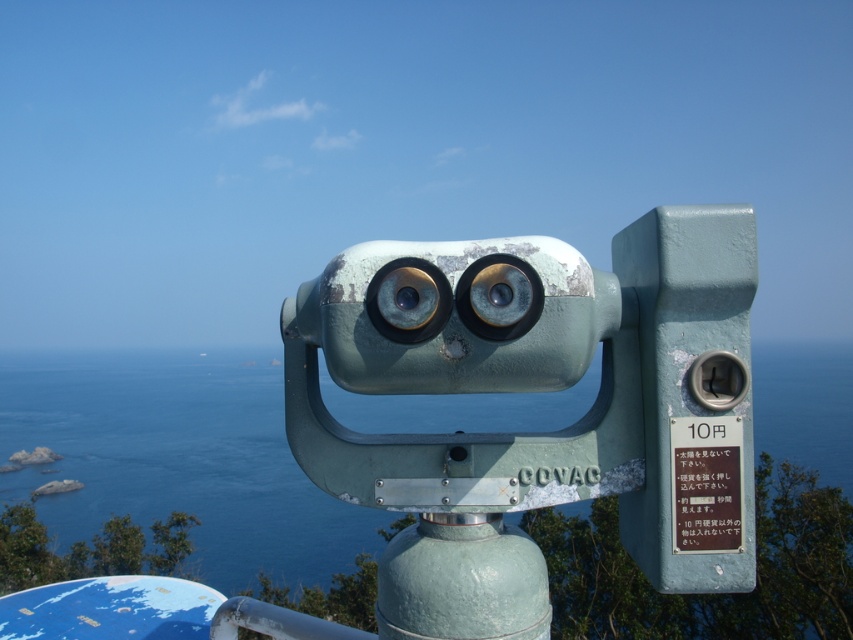
You are standing at the scenic overlook and want to take a photo of the blue water at center. However, the green patina telescope at center is blocking your view. Can you move the telescope to the side to get an unobstructed shot?

The green patina telescope at center is in front of blue water at center, so moving it to the side would allow you to see the blue water at center without obstruction.

You are standing at the green patina telescope at center and want to reach the blue water at center. The path between them is clear. Can you walk directly to the water without any obstacles?

The green patina telescope at center is 3.95 meters away from blue water at center, so yes, you can walk directly to the water without any obstacles since the distance is manageable and the path is clear.